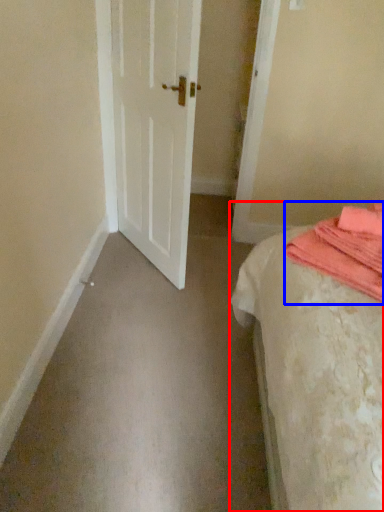
Question: Among these objects, which one is farthest to the camera, bed (highlighted by a red box) or blanket (highlighted by a blue box)?

Choices:
 (A) bed
 (B) blanket

Answer: (B)